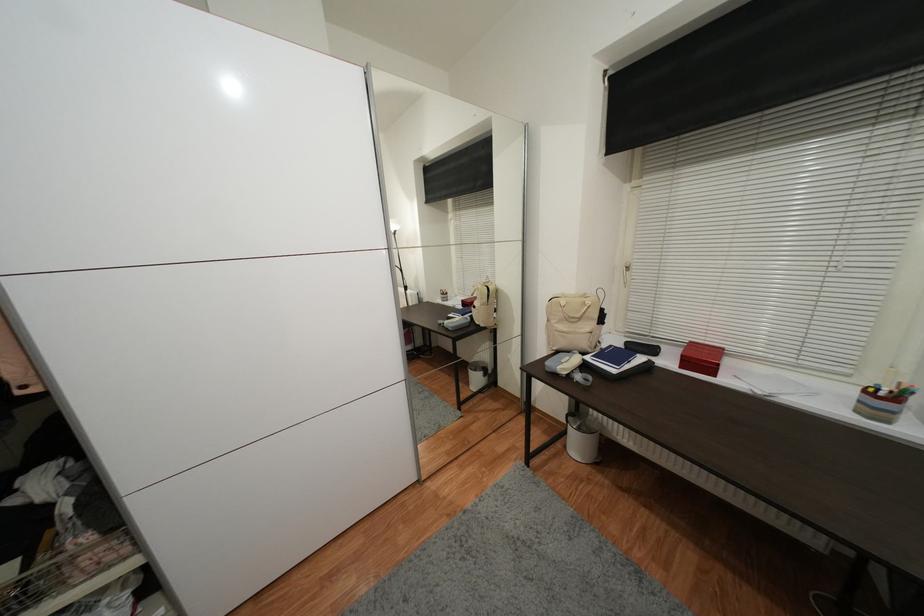
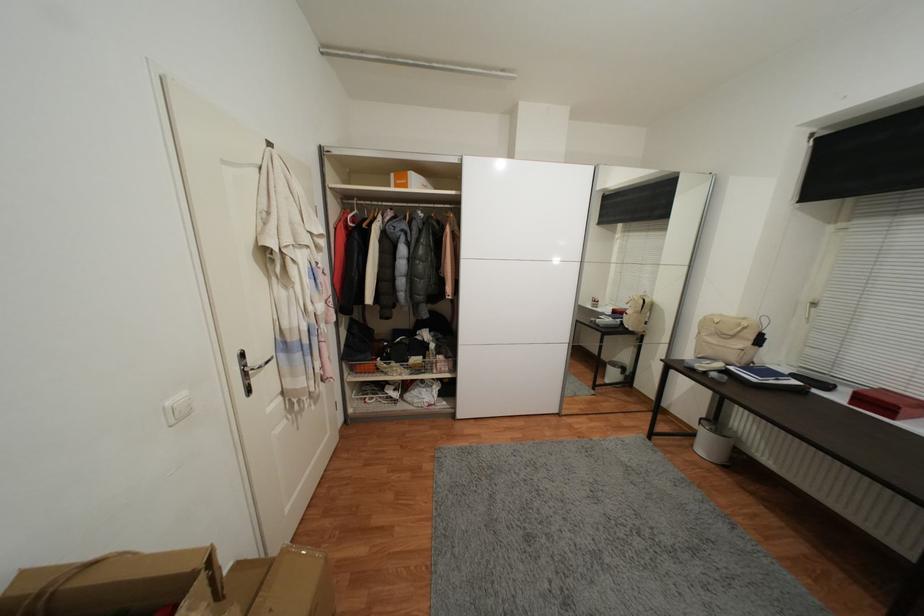
Locate, in the second image, the point that corresponds to (719,377) in the first image.

(897, 419)